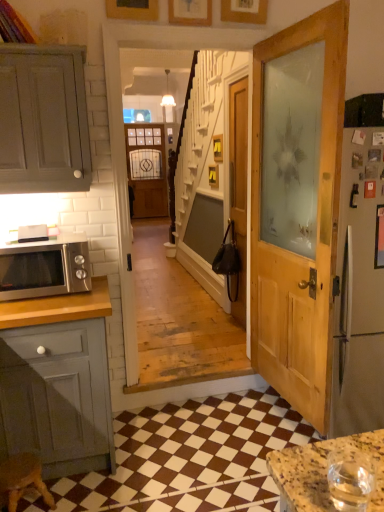
Question: Is wooden door at center to the right of wooden picture frame at upper center, the 3th picture frame viewed from the right, from the viewer's perspective?

Choices:
 (A) yes
 (B) no

Answer: (A)

Question: Is wooden door at center bigger than wooden picture frame at upper center, the 3th picture frame viewed from the right?

Choices:
 (A) no
 (B) yes

Answer: (B)

Question: From the image's perspective, is wooden door at center above wooden picture frame at upper center, the 1th picture frame viewed from the left?

Choices:
 (A) no
 (B) yes

Answer: (A)

Question: Could you tell me if wooden door at center is facing wooden picture frame at upper center, the 1th picture frame viewed from the left?

Choices:
 (A) no
 (B) yes

Answer: (A)

Question: Considering the relative sizes of wooden door at center and wooden picture frame at upper center, the 1th picture frame viewed from the left, in the image provided, is wooden door at center taller than wooden picture frame at upper center, the 1th picture frame viewed from the left,?

Choices:
 (A) yes
 (B) no

Answer: (A)

Question: From a real-world perspective, is satin silver microwave at left positioned above or below wooden door at center?

Choices:
 (A) above
 (B) below

Answer: (B)

Question: Visually, is satin silver microwave at left positioned to the left or to the right of wooden door at center?

Choices:
 (A) right
 (B) left

Answer: (B)

Question: Considering the positions of point (9, 274) and point (235, 142), is point (9, 274) closer or farther from the camera than point (235, 142)?

Choices:
 (A) closer
 (B) farther

Answer: (A)

Question: Looking at their shapes, would you say satin silver microwave at left is wider or thinner than wooden door at center?

Choices:
 (A) wide
 (B) thin

Answer: (A)

Question: Is matte wooden screen door at center bigger or smaller than matte gray cabinet at left?

Choices:
 (A) small
 (B) big

Answer: (B)

Question: From a real-world perspective, is matte wooden screen door at center positioned above or below matte gray cabinet at left?

Choices:
 (A) above
 (B) below

Answer: (B)

Question: From the image's perspective, is matte wooden screen door at center positioned above or below matte gray cabinet at left?

Choices:
 (A) above
 (B) below

Answer: (A)

Question: In terms of width, does matte wooden screen door at center look wider or thinner when compared to matte gray cabinet at left?

Choices:
 (A) wide
 (B) thin

Answer: (B)

Question: In terms of size, does wooden door at center appear bigger or smaller than wooden picture frame at upper center, the 3th picture frame viewed from the right?

Choices:
 (A) small
 (B) big

Answer: (B)

Question: Is wooden door at center to the left or to the right of wooden picture frame at upper center, the 1th picture frame viewed from the left, in the image?

Choices:
 (A) right
 (B) left

Answer: (A)